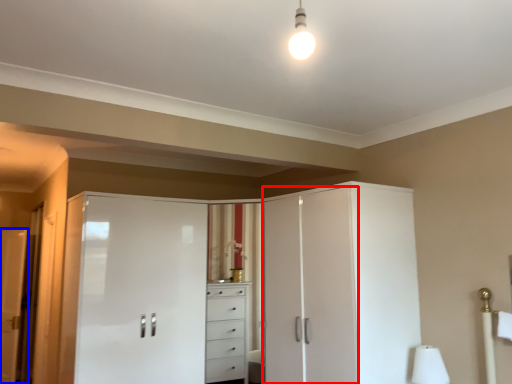
Question: Among these objects, which one is farthest to the camera, screen door (highlighted by a red box) or door (highlighted by a blue box)?

Choices:
 (A) screen door
 (B) door

Answer: (B)